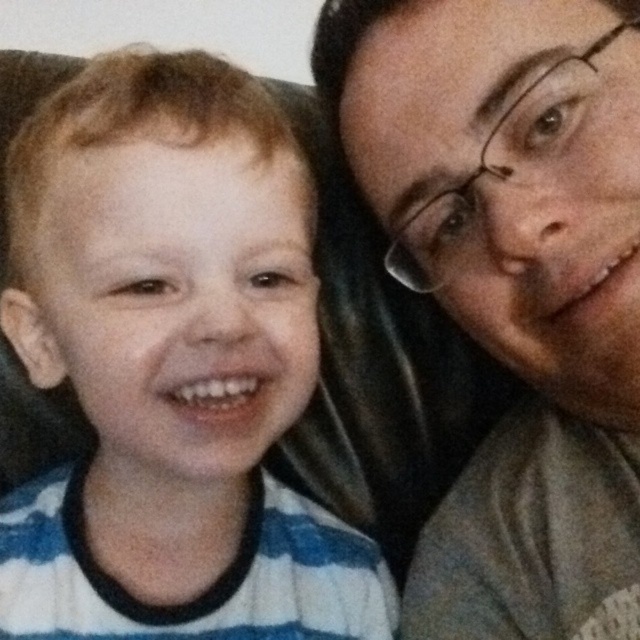
Question: Does white striped sweater at left appear under matte gray shirt at right?

Choices:
 (A) no
 (B) yes

Answer: (B)

Question: Observing the image, what is the correct spatial positioning of white striped sweater at left in reference to matte gray shirt at right?

Choices:
 (A) right
 (B) left

Answer: (B)

Question: Which point is farther to the camera?

Choices:
 (A) (97, 573)
 (B) (400, 262)

Answer: (B)

Question: Is white striped sweater at left above matte gray shirt at right?

Choices:
 (A) yes
 (B) no

Answer: (B)

Question: Among these points, which one is nearest to the camera?

Choices:
 (A) (586, 189)
 (B) (160, 579)

Answer: (A)